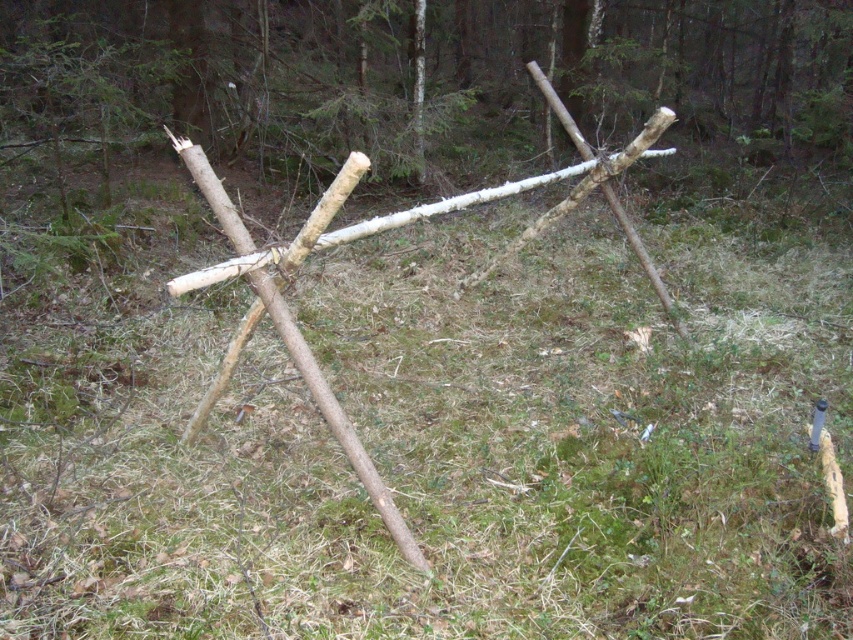
Which is more to the right, green grass at center or natural wood stick at center?

From the viewer's perspective, natural wood stick at center appears more on the right side.

Describe the element at coordinates (444, 449) in the screenshot. This screenshot has height=640, width=853. I see `green grass at center` at that location.

Locate an element on the screen. This screenshot has width=853, height=640. green grass at center is located at coordinates pos(444,449).